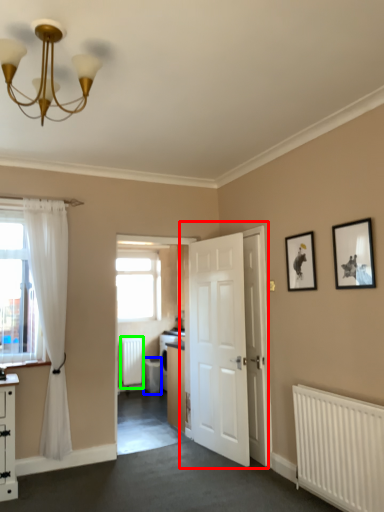
Question: Which object is the farthest from door (highlighted by a red box)? Choose among these: dish washer (highlighted by a blue box) or radiator (highlighted by a green box).

Choices:
 (A) dish washer
 (B) radiator

Answer: (B)